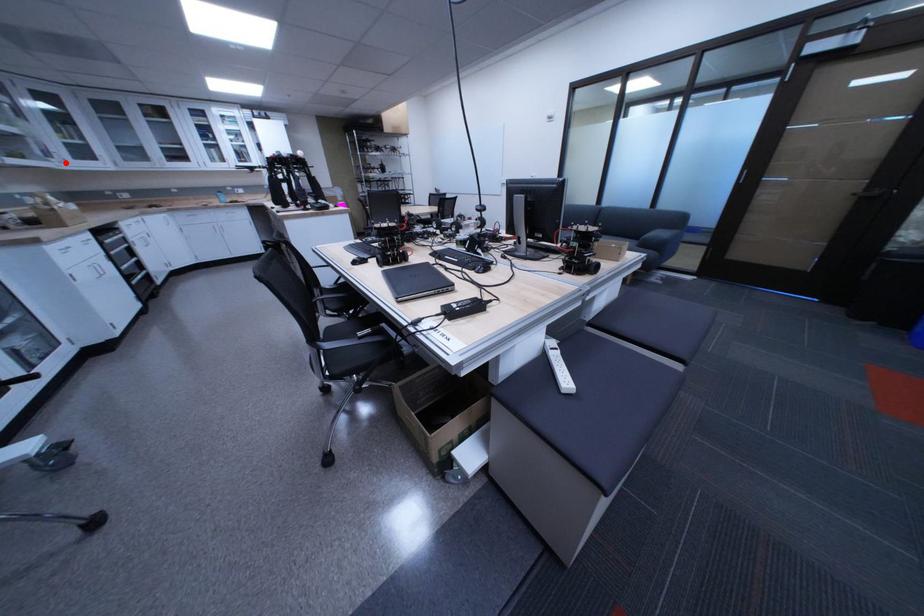
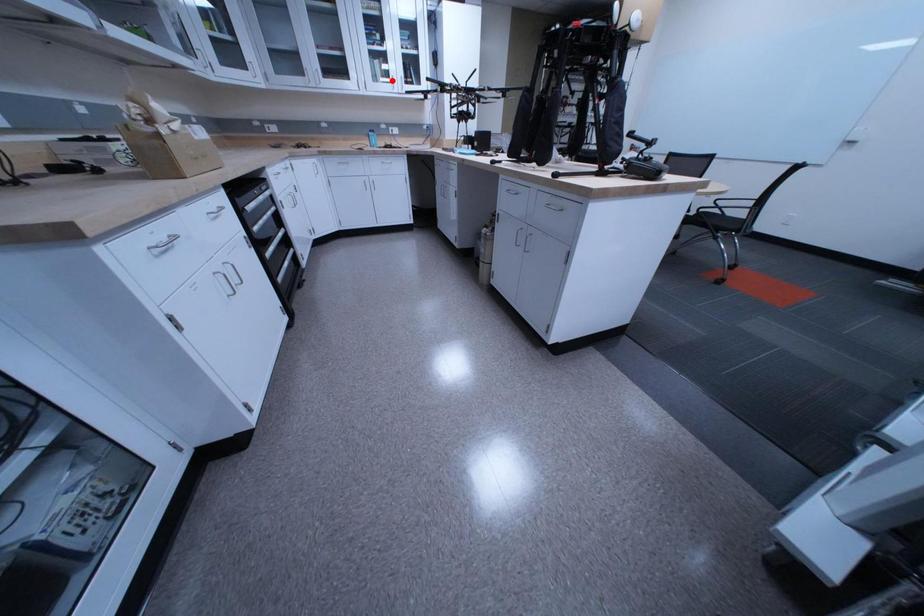
I am providing you with two images of the same scene from different viewpoints. A red point is marked on the first image and another point is marked on the second image. Is the marked point in image1 the same physical position as the marked point in image2?

No